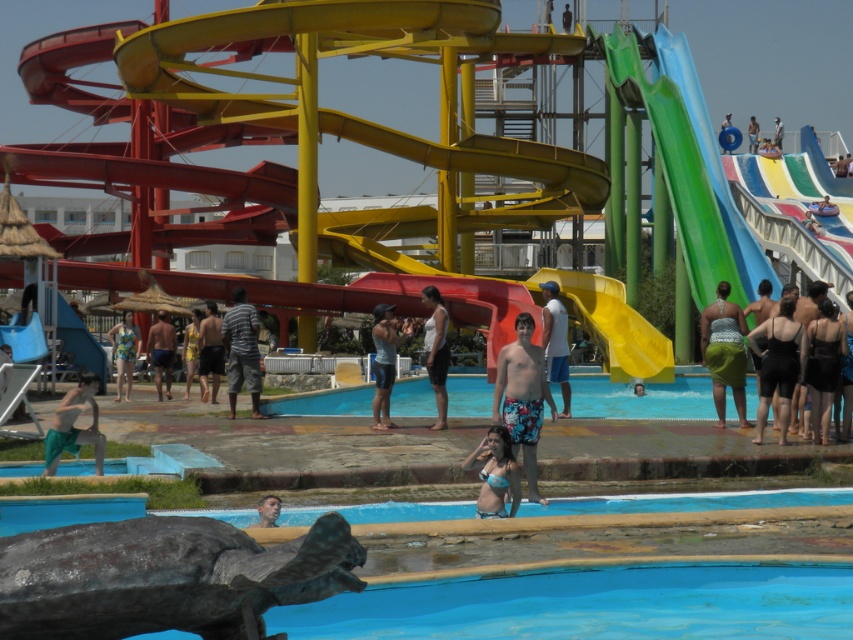
Question: Which of the following is the farthest from the observer?

Choices:
 (A) blue shorts at center
 (B) blue smooth pool at lower center
 (C) matte black swim trunks at upper right
 (D) yellow fabric shorts at center

Answer: (A)

Question: Which object is the farthest from the smooth skin face at lower center?

Choices:
 (A) blue bikini at center
 (B) light blue shorts at lower left
 (C) blue shorts at center
 (D) floral shorts at center

Answer: (C)

Question: Does yellow rubber slide at center come in front of blue swim trunks at center?

Choices:
 (A) no
 (B) yes

Answer: (A)

Question: Can you confirm if blue swimsuit at center is positioned to the left of matte black swim trunks at upper right?

Choices:
 (A) no
 (B) yes

Answer: (B)

Question: Which point is closer to the camera?

Choices:
 (A) white matte tank top at center
 (B) yellow rubber slide at center

Answer: (A)

Question: From the image, what is the correct spatial relationship of multicolored swimsuit at center in relation to matte black swim trunks at upper right?

Choices:
 (A) right
 (B) left

Answer: (B)